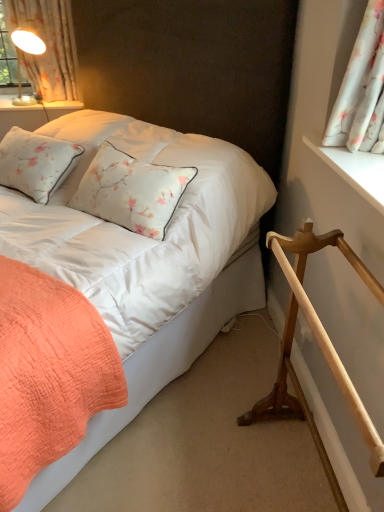
Question: From the image's perspective, is white wooden window sill at upper right below coral quilted bed at lower left?

Choices:
 (A) yes
 (B) no

Answer: (A)

Question: Is white wooden window sill at upper right facing towards coral quilted bed at lower left?

Choices:
 (A) no
 (B) yes

Answer: (B)

Question: Is white wooden window sill at upper right far from coral quilted bed at lower left?

Choices:
 (A) no
 (B) yes

Answer: (A)

Question: Is the depth of white wooden window sill at upper right greater than that of coral quilted bed at lower left?

Choices:
 (A) yes
 (B) no

Answer: (A)

Question: From a real-world perspective, is white wooden window sill at upper right under coral quilted bed at lower left?

Choices:
 (A) yes
 (B) no

Answer: (B)

Question: Is white wooden window sill at upper right taller than coral quilted bed at lower left?

Choices:
 (A) yes
 (B) no

Answer: (B)

Question: Does light brown wooden rail at lower right have a lesser height compared to coral quilted bed at lower left?

Choices:
 (A) no
 (B) yes

Answer: (B)

Question: Is light brown wooden rail at lower right not within coral quilted bed at lower left?

Choices:
 (A) no
 (B) yes

Answer: (B)

Question: Considering the relative sizes of light brown wooden rail at lower right and coral quilted bed at lower left in the image provided, is light brown wooden rail at lower right bigger than coral quilted bed at lower left?

Choices:
 (A) yes
 (B) no

Answer: (B)

Question: Is light brown wooden rail at lower right further to the viewer compared to coral quilted bed at lower left?

Choices:
 (A) no
 (B) yes

Answer: (B)

Question: Could you tell me if light brown wooden rail at lower right is turned towards coral quilted bed at lower left?

Choices:
 (A) yes
 (B) no

Answer: (B)

Question: Considering the relative sizes of light brown wooden rail at lower right and coral quilted bed at lower left in the image provided, is light brown wooden rail at lower right wider than coral quilted bed at lower left?

Choices:
 (A) yes
 (B) no

Answer: (B)

Question: Is light brown wooden rail at lower right in front of white floral fabric at upper right, which ranks as the first curtain in right-to-left order?

Choices:
 (A) yes
 (B) no

Answer: (A)